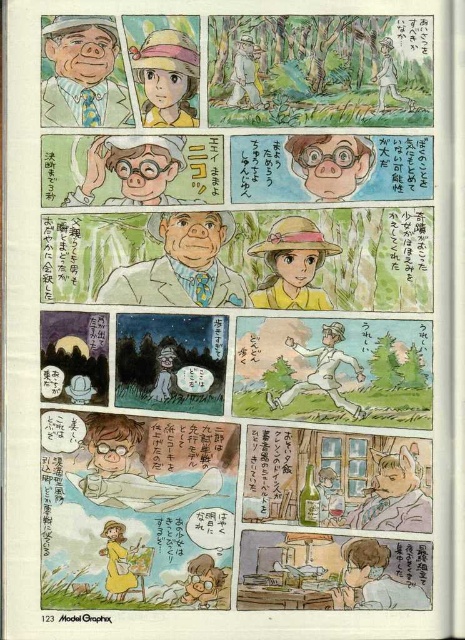
Does yellow straw hat at center have a greater width compared to matte pink glasses at upper right?

Yes.

Between point (309, 220) and point (286, 145), which one is positioned behind?

Positioned behind is point (309, 220).

Is point (292, 228) closer to viewer compared to point (334, 188)?

No.

The image size is (465, 640). What are the coordinates of `yellow straw hat at center` in the screenshot? It's located at (292, 266).

Is smooth brown hair at lower right to the right of light brown paper bag at upper center from the viewer's perspective?

Correct, you'll find smooth brown hair at lower right to the right of light brown paper bag at upper center.

The height and width of the screenshot is (640, 465). I want to click on smooth brown hair at lower right, so click(x=373, y=579).

Locate an element on the screen. The height and width of the screenshot is (640, 465). smooth brown hair at lower right is located at coordinates (373, 579).

Is point (193, 438) in front of point (183, 221)?

That is True.

You are a GUI agent. You are given a task and a screenshot of the screen. Output one action in this format:
    pyautogui.click(x=<x>, y=<y>)
    Task: Click on the matte brown glasses at center
    
    Given the screenshot: What is the action you would take?
    pyautogui.click(x=146, y=461)

Is point (85, 436) less distant than point (220, 269)?

Yes, point (85, 436) is in front of point (220, 269).

Where is `matte brown glasses at center`? The height and width of the screenshot is (640, 465). matte brown glasses at center is located at coordinates (146, 461).